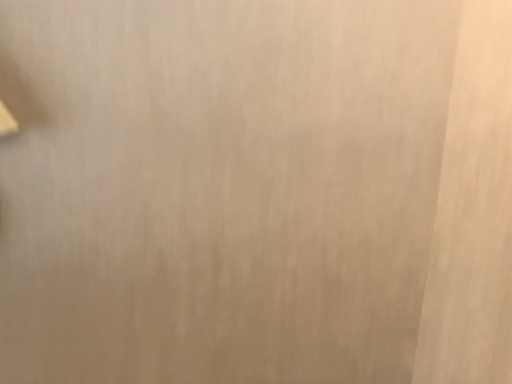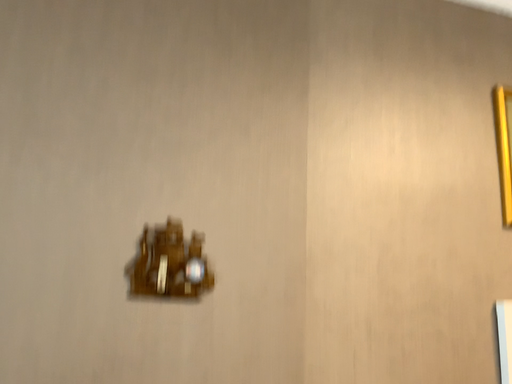
Question: Which way did the camera rotate in the video?

Choices:
 (A) rotated downward
 (B) rotated upward

Answer: (B)